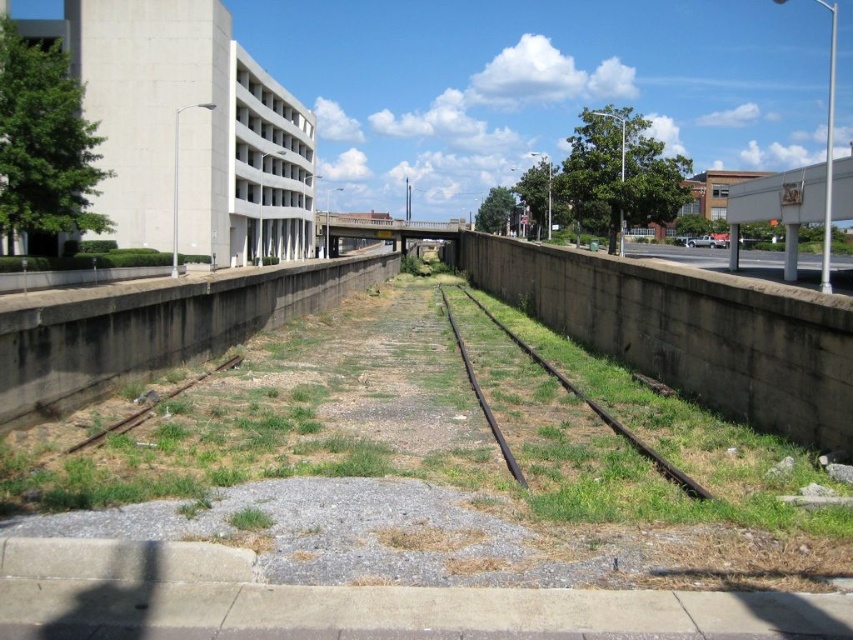
You are a maintenance worker assigned to inspect the green grass at center and the rusty metal train track at center in the abandoned railway area. Which of these two objects is located to the left of the other?

The green grass at center is positioned on the left side of the rusty metal train track at center, so the green grass at center is to the left of the rusty metal train track at center.

You are standing on the abandoned railway tracks and looking towards the multi story parking garage. Where is the green grass at center located relative to the tracks?

The green grass at center is located at point (x=434, y=452) relative to the tracks.

You are standing at the point marked as point (x=434, y=452) in the urban scene. What do you see directly in front of you?

You see green grass at center directly in front of you at point (x=434, y=452).